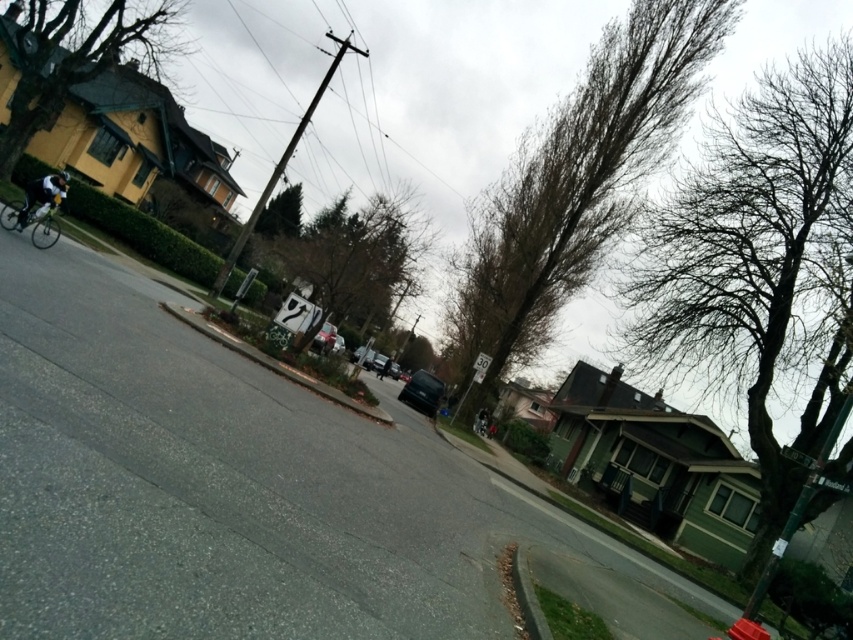
You are a delivery person with a 6 foot wide package that needs to be transported through the suburban street scene. The package must be carried along the road between the bare branches at upper center and the shiny silver bicycle at left. Is there enough space for the package to pass through this area?

The distance between the bare branches at upper center and the shiny silver bicycle at left is 66.03 feet. Since the package is only 6 feet wide, there is more than enough space for it to pass through the area between them.

You are standing on the suburban street scene and want to walk from point (579, 208) to point (370, 275). Which direction should you move relative to your current position?

You should move forward because point (579, 208) is further away from the camera than point (370, 275), so moving towards the camera direction would bring you closer to the destination point.